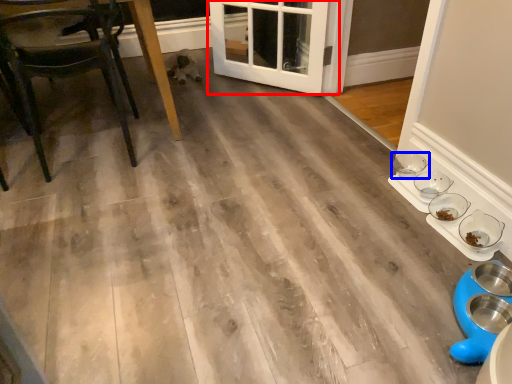
Question: Which object is further to the camera taking this photo, door (highlighted by a red box) or bowl (highlighted by a blue box)?

Choices:
 (A) door
 (B) bowl

Answer: (A)